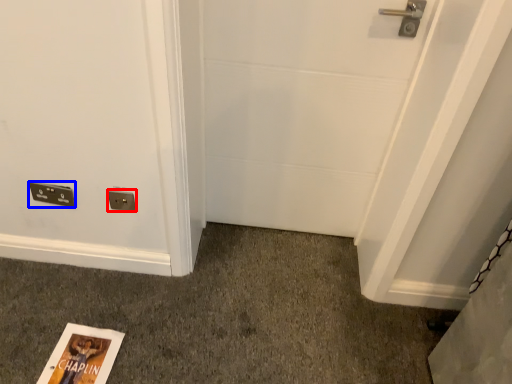
Question: Which object appears farthest to the camera in this image, electric outlet (highlighted by a red box) or light switch (highlighted by a blue box)?

Choices:
 (A) electric outlet
 (B) light switch

Answer: (B)